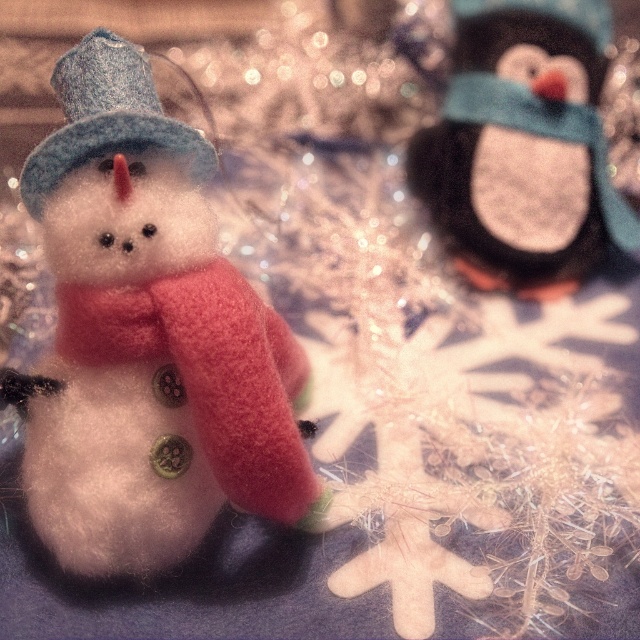
Question: Which point is farther to the camera?

Choices:
 (A) felt blue hat at left
 (B) felt snowman at left

Answer: (B)

Question: Is felt penguin at upper right thinner than felt blue hat at left?

Choices:
 (A) no
 (B) yes

Answer: (A)

Question: Does felt penguin at upper right lie in front of felt blue hat at left?

Choices:
 (A) no
 (B) yes

Answer: (A)

Question: Which point is farther from the camera taking this photo?

Choices:
 (A) (602, 20)
 (B) (52, 161)

Answer: (A)

Question: Can you confirm if felt penguin at upper right is wider than felt blue hat at left?

Choices:
 (A) no
 (B) yes

Answer: (B)

Question: Among these points, which one is farthest from the camera?

Choices:
 (A) (225, 451)
 (B) (99, 150)
 (C) (497, 161)

Answer: (C)